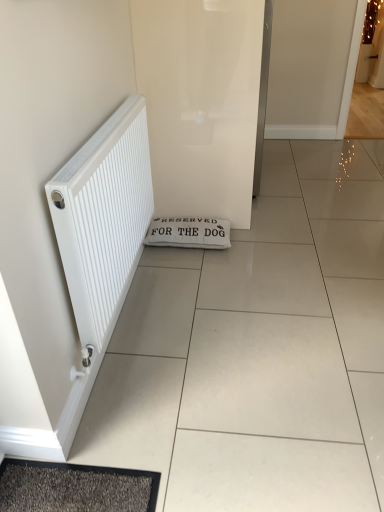
Question: Should I look upward or downward to see white glossy screen door at center?

Choices:
 (A) up
 (B) down

Answer: (A)

Question: Can you confirm if white glossy screen door at center is thinner than white matte radiator at left?

Choices:
 (A) yes
 (B) no

Answer: (B)

Question: Does white glossy screen door at center have a larger size compared to white matte radiator at left?

Choices:
 (A) no
 (B) yes

Answer: (B)

Question: Is white glossy screen door at center closer to camera compared to white matte radiator at left?

Choices:
 (A) no
 (B) yes

Answer: (A)

Question: Could you tell me if white glossy screen door at center is facing white matte radiator at left?

Choices:
 (A) yes
 (B) no

Answer: (B)

Question: Does white glossy screen door at center have a greater width compared to white matte radiator at left?

Choices:
 (A) no
 (B) yes

Answer: (B)

Question: Considering the relative positions of white glossy screen door at center and white matte radiator at left in the image provided, is white glossy screen door at center to the right of white matte radiator at left from the viewer's perspective?

Choices:
 (A) no
 (B) yes

Answer: (B)

Question: Can you confirm if white fabric doormat at center is smaller than white matte radiator at left?

Choices:
 (A) yes
 (B) no

Answer: (A)

Question: Is white fabric doormat at center positioned with its back to white matte radiator at left?

Choices:
 (A) no
 (B) yes

Answer: (A)

Question: From a real-world perspective, does white fabric doormat at center stand above white matte radiator at left?

Choices:
 (A) no
 (B) yes

Answer: (A)

Question: Is white fabric doormat at center bigger than white matte radiator at left?

Choices:
 (A) no
 (B) yes

Answer: (A)

Question: Is white fabric doormat at center surrounding white matte radiator at left?

Choices:
 (A) no
 (B) yes

Answer: (A)

Question: Is white fabric doormat at center oriented towards white matte radiator at left?

Choices:
 (A) yes
 (B) no

Answer: (B)

Question: Is white matte radiator at left taller than white glossy screen door at center?

Choices:
 (A) yes
 (B) no

Answer: (B)